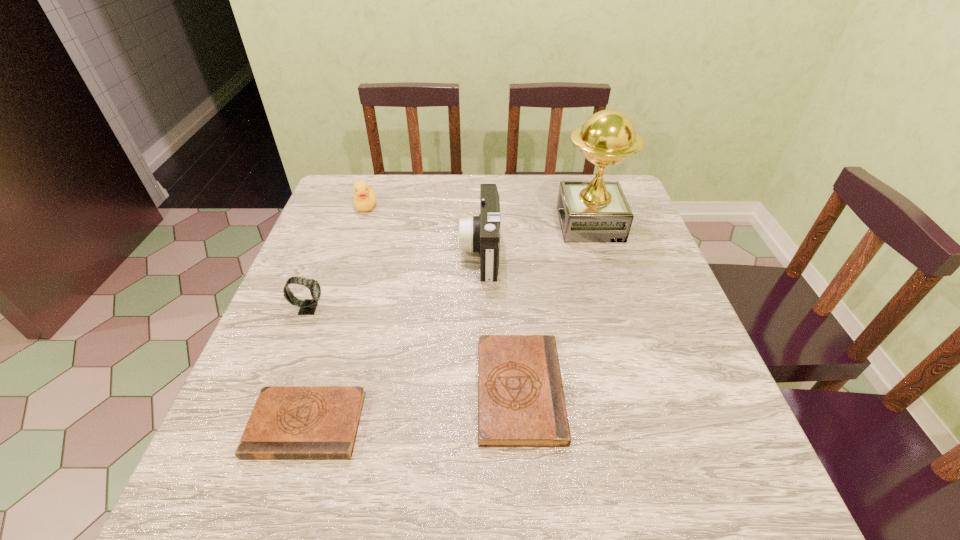
At what (x,y) coordinates should I click in order to perform the action: click on vacant point at the far left corner. Please return your answer as a coordinate pair (x, y). Image resolution: width=960 pixels, height=540 pixels. Looking at the image, I should click on coord(333,186).

The image size is (960, 540). Find the location of `free point at the near right corner`. free point at the near right corner is located at coordinates (724, 406).

Find the location of a particular element. free space between the camcorder and the shortest object is located at coordinates (394, 338).

Find the location of a particular element. vacant space that's between the watch and the shortest object is located at coordinates (307, 367).

Find the location of a particular element. Image resolution: width=960 pixels, height=540 pixels. free space between the second shortest object and the left diary is located at coordinates (413, 407).

The image size is (960, 540). I want to click on free space between the watch and the rightmost object, so click(449, 266).

In order to click on vacant area that lies between the duckling and the fifth shortest object in this screenshot , I will do `click(423, 229)`.

The image size is (960, 540). I want to click on free space between the shortest object and the award, so click(x=448, y=324).

At what (x,y) coordinates should I click in order to perform the action: click on free point between the shortest object and the rightmost object. Please return your answer as a coordinate pair (x, y). Looking at the image, I should click on (448, 324).

You are a GUI agent. You are given a task and a screenshot of the screen. Output one action in this format:
    pyautogui.click(x=<x>, y=<y>)
    Task: Click on the free point between the duckling and the watch
    This screenshot has height=540, width=960.
    Given the screenshot: What is the action you would take?
    pyautogui.click(x=337, y=258)